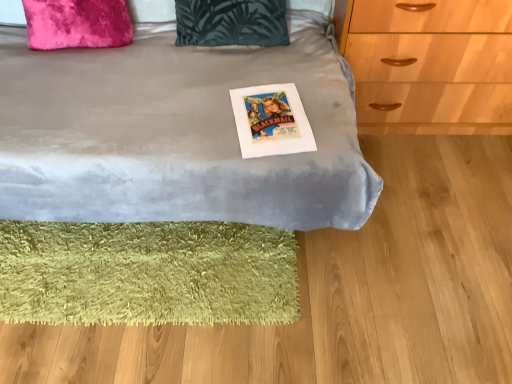
Question: Is white paper poster at center inside dark green fabric pillow at upper center, placed as the second pillow when sorted from left to right?

Choices:
 (A) yes
 (B) no

Answer: (B)

Question: Can you confirm if dark green fabric pillow at upper center, which is the 1th pillow in right-to-left order, is shorter than white paper poster at center?

Choices:
 (A) no
 (B) yes

Answer: (A)

Question: Considering the relative sizes of dark green fabric pillow at upper center, placed as the second pillow when sorted from left to right, and white paper poster at center in the image provided, is dark green fabric pillow at upper center, placed as the second pillow when sorted from left to right, bigger than white paper poster at center?

Choices:
 (A) yes
 (B) no

Answer: (A)

Question: From a real-world perspective, is dark green fabric pillow at upper center, placed as the second pillow when sorted from left to right, under white paper poster at center?

Choices:
 (A) yes
 (B) no

Answer: (B)

Question: Could you tell me if dark green fabric pillow at upper center, which is the 1th pillow in right-to-left order, is turned towards white paper poster at center?

Choices:
 (A) yes
 (B) no

Answer: (A)

Question: Is white paper poster at center bigger or smaller than velvet gray bed at center?

Choices:
 (A) small
 (B) big

Answer: (A)

Question: Is white paper poster at center wider or thinner than velvet gray bed at center?

Choices:
 (A) wide
 (B) thin

Answer: (B)

Question: Considering the relative positions of white paper poster at center and velvet gray bed at center in the image provided, is white paper poster at center to the left or to the right of velvet gray bed at center?

Choices:
 (A) right
 (B) left

Answer: (A)

Question: From the image's perspective, relative to velvet gray bed at center, is white paper poster at center above or below?

Choices:
 (A) above
 (B) below

Answer: (B)

Question: Does point (246, 13) appear closer or farther from the camera than point (289, 119)?

Choices:
 (A) closer
 (B) farther

Answer: (B)

Question: In terms of height, does dark green fabric pillow at upper center, placed as the second pillow when sorted from left to right, look taller or shorter compared to white paper poster at center?

Choices:
 (A) tall
 (B) short

Answer: (A)

Question: Choose the correct answer: Is dark green fabric pillow at upper center, which is the 1th pillow in right-to-left order, inside white paper poster at center or outside it?

Choices:
 (A) inside
 (B) outside

Answer: (B)

Question: From a real-world perspective, is dark green fabric pillow at upper center, placed as the second pillow when sorted from left to right, physically located above or below white paper poster at center?

Choices:
 (A) below
 (B) above

Answer: (B)

Question: Which is correct: velvet pink pillow at upper left, the 1th pillow viewed from the left, is inside velvet gray bed at center, or outside of it?

Choices:
 (A) outside
 (B) inside

Answer: (B)

Question: In the image, is velvet pink pillow at upper left, arranged as the 2th pillow when viewed from the right, positioned in front of or behind velvet gray bed at center?

Choices:
 (A) behind
 (B) front

Answer: (A)